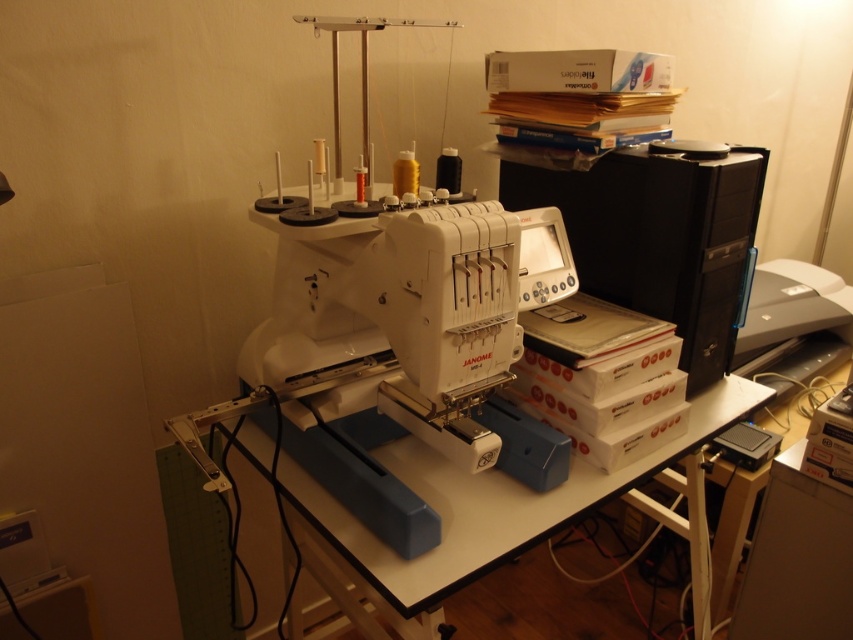
Question: Can you confirm if black plastic computer at right is wider than white plastic table at center?

Choices:
 (A) yes
 (B) no

Answer: (B)

Question: Can you confirm if white plastic sewing machine at center is positioned to the left of black plastic computer at right?

Choices:
 (A) no
 (B) yes

Answer: (B)

Question: Which object is the closest to the black plastic computer at right?

Choices:
 (A) white plastic sewing machine at center
 (B) white plastic table at center

Answer: (B)

Question: Which object appears closest to the camera in this image?

Choices:
 (A) white plastic sewing machine at center
 (B) black plastic computer at right

Answer: (A)

Question: Which object is farther from the camera taking this photo?

Choices:
 (A) white plastic table at center
 (B) black plastic computer at right

Answer: (B)

Question: Does black plastic computer at right have a lesser width compared to white plastic table at center?

Choices:
 (A) yes
 (B) no

Answer: (A)